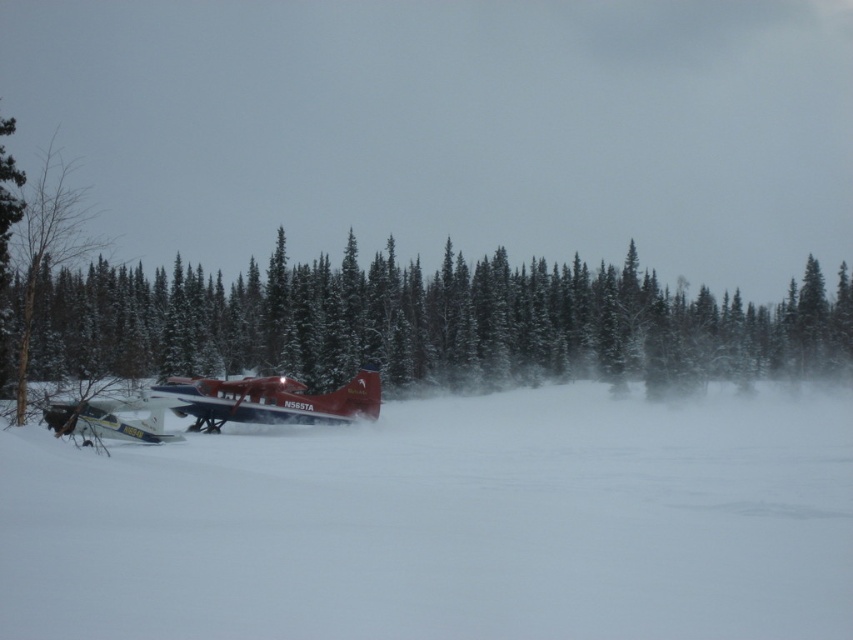
Between white fluffy snow at center and white matte airplane at lower left, which one appears on the right side from the viewer's perspective?

From the viewer's perspective, white fluffy snow at center appears more on the right side.

Does white fluffy snow at center appear on the left side of white matte airplane at lower left?

No, white fluffy snow at center is not to the left of white matte airplane at lower left.

Is point (260, 477) closer to camera compared to point (151, 428)?

That is True.

I want to click on white fluffy snow at center, so click(x=445, y=522).

What do you see at coordinates (426, 323) in the screenshot? I see `green textured pine tree at center` at bounding box center [426, 323].

Does green textured pine tree at center appear on the right side of metallic blue airplane at center?

Correct, you'll find green textured pine tree at center to the right of metallic blue airplane at center.

Which is behind, point (300, 369) or point (260, 397)?

The point (300, 369) is more distant.

Image resolution: width=853 pixels, height=640 pixels. Find the location of `green textured pine tree at center`. green textured pine tree at center is located at coordinates (426, 323).

Can you confirm if metallic blue airplane at center is positioned below white matte airplane at lower left?

No.

Between point (213, 388) and point (143, 424), which one is positioned behind?

The point (213, 388) is more distant.

Locate an element on the screen. The width and height of the screenshot is (853, 640). metallic blue airplane at center is located at coordinates (270, 401).